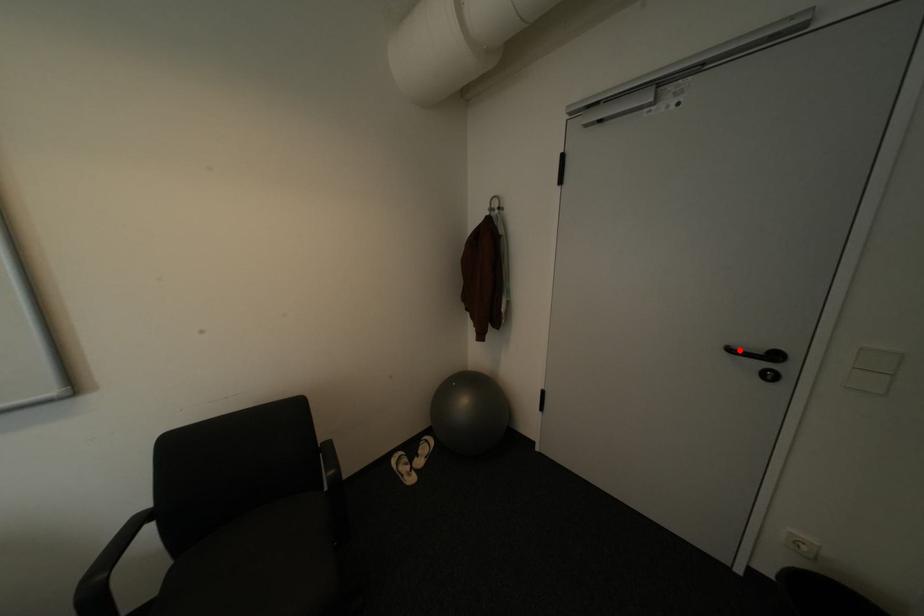
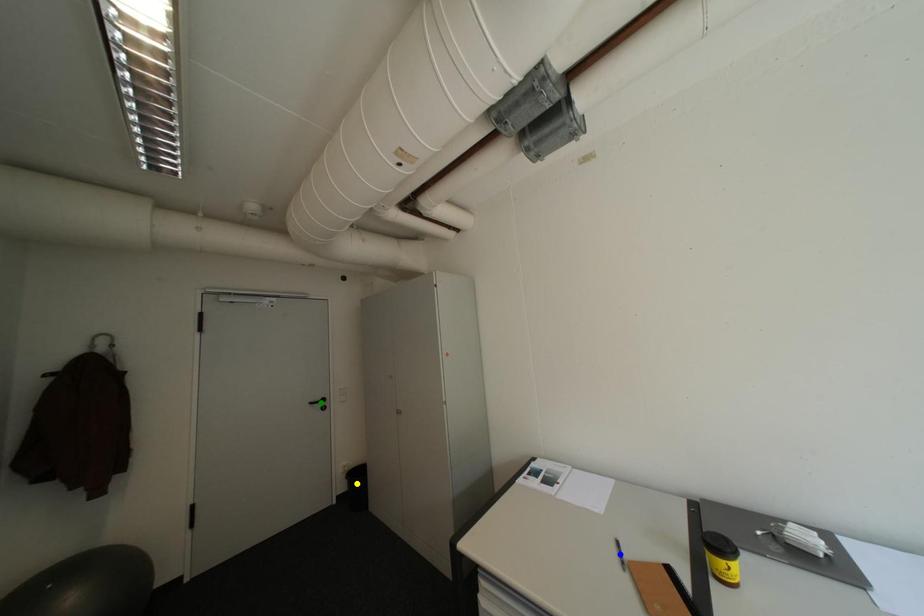
Question: I am providing you with two images of the same scene from different viewpoints. A red point is marked on the first image. You are given multiple points on the second image. Which point in image 2 represents the same 3d spot as the red point in image 1?

Choices:
 (A) green point
 (B) blue point
 (C) yellow point

Answer: (A)